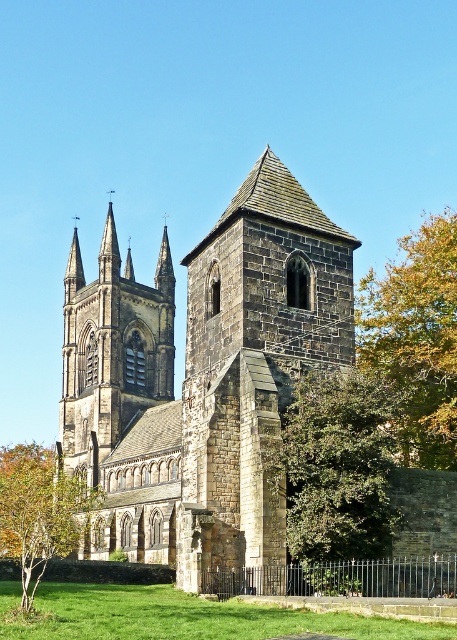
Measure the distance between green leafy tree at center and camera.

green leafy tree at center is 138.19 feet from camera.

Which is below, green leafy tree at center or green grass at lower center?

Positioned lower is green grass at lower center.

The image size is (457, 640). What do you see at coordinates (336, 467) in the screenshot? I see `green leafy tree at center` at bounding box center [336, 467].

Identify the location of green leafy tree at center. (336, 467).

Is dark gray stone church at center above green leafy tree at right?

Incorrect, dark gray stone church at center is not positioned above green leafy tree at right.

In the scene shown: Does dark gray stone church at center appear on the right side of green leafy tree at right?

No, dark gray stone church at center is not to the right of green leafy tree at right.

Between point (249, 372) and point (426, 378), which one is positioned behind?

Positioned behind is point (426, 378).

Where is `dark gray stone church at center`? The height and width of the screenshot is (640, 457). dark gray stone church at center is located at coordinates (201, 376).

Is point (338, 355) positioned in front of point (15, 538)?

That is True.

Which is above, dark gray stone church at center or green leafy tree at lower left?

dark gray stone church at center is above.

Does point (96, 314) come in front of point (62, 525)?

No, it is behind (62, 525).

Where is `dark gray stone church at center`? The width and height of the screenshot is (457, 640). dark gray stone church at center is located at coordinates (201, 376).